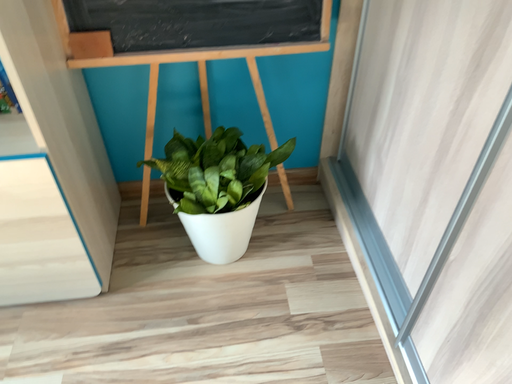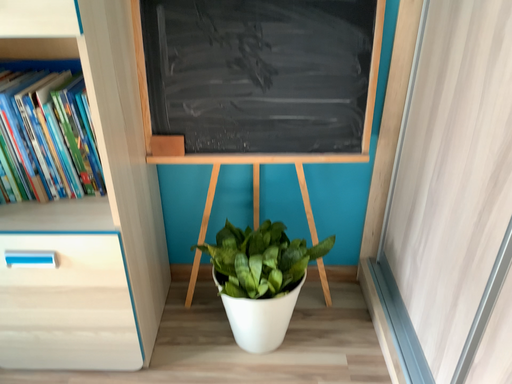
Question: How did the camera likely rotate when shooting the video?

Choices:
 (A) rotated upward
 (B) rotated downward

Answer: (A)